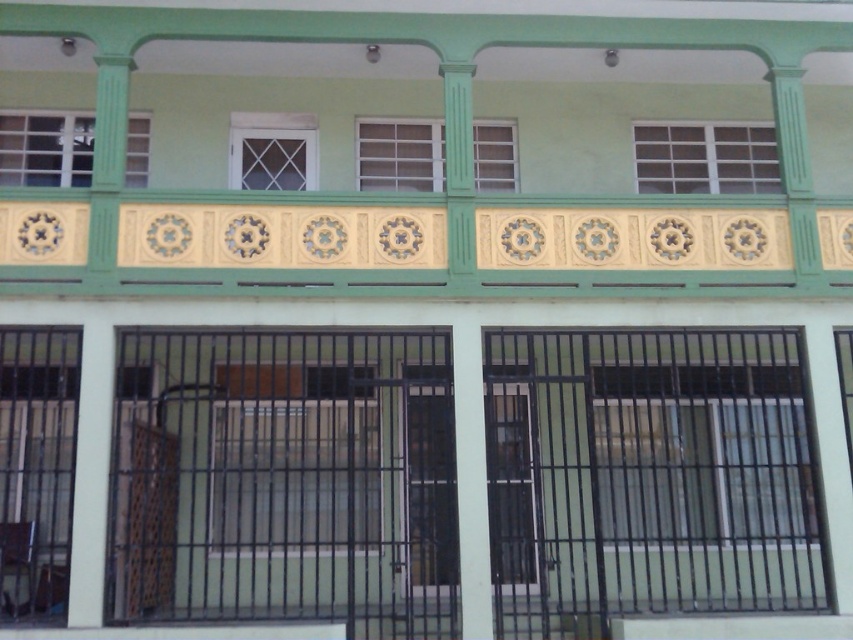
Does point (485, 276) lie behind point (315, 408)?

No, it is not.

Can you confirm if yellow matte tile at upper center is shorter than clear glass window at center?

Yes, yellow matte tile at upper center is shorter than clear glass window at center.

Where is `yellow matte tile at upper center`? This screenshot has height=640, width=853. yellow matte tile at upper center is located at coordinates (445, 132).

Which of these two, yellow matte tile at upper center or white plastic window at center, stands taller?

With more height is white plastic window at center.

Identify the location of yellow matte tile at upper center. [445, 132].

How much distance is there between matte green window at upper left and white lattice window at center?

6.69 feet

Who is more distant from viewer, (0, 116) or (230, 173)?

The point (0, 116) is more distant.

Measure the distance between point [44,180] and camera.

Point [44,180] and camera are 10.92 meters apart.

At what (x,y) coordinates should I click in order to perform the action: click on matte green window at upper left. Please return your answer as a coordinate pair (x, y). Looking at the image, I should click on (45, 148).